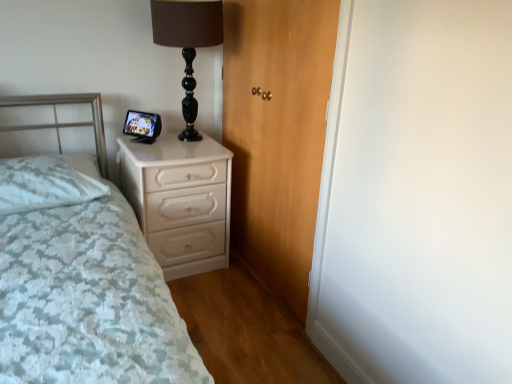
Question: From a real-world perspective, is white textured pillow at left positioned above or below wooden door at center?

Choices:
 (A) above
 (B) below

Answer: (B)

Question: From the image's perspective, is white textured pillow at left positioned above or below wooden door at center?

Choices:
 (A) above
 (B) below

Answer: (B)

Question: Considering the real-world distances, which object is closest to the white glossy chest of drawers at center?

Choices:
 (A) black glass table lamp at upper center
 (B) wooden door at center
 (C) white textured bed at left
 (D) white textured pillow at left

Answer: (D)

Question: Based on their relative distances, which object is farther from the white glossy chest of drawers at center?

Choices:
 (A) wooden door at center
 (B) white textured bed at left
 (C) white textured pillow at left
 (D) black glass table lamp at upper center

Answer: (D)